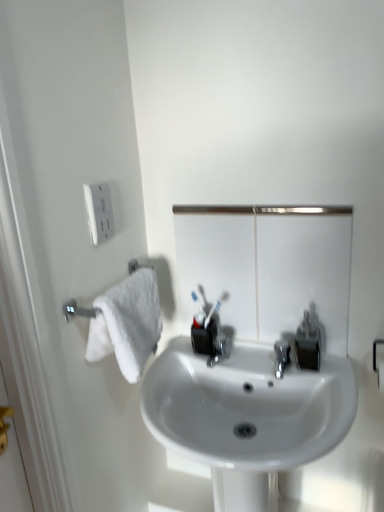
Question: Is matte black soap dispenser at center right bigger than metallic reflective mirror at center?

Choices:
 (A) yes
 (B) no

Answer: (B)

Question: Does matte black soap dispenser at center right have a lesser height compared to metallic reflective mirror at center?

Choices:
 (A) yes
 (B) no

Answer: (A)

Question: Is matte black soap dispenser at center right taller than metallic reflective mirror at center?

Choices:
 (A) no
 (B) yes

Answer: (A)

Question: Does matte black soap dispenser at center right come in front of metallic reflective mirror at center?

Choices:
 (A) no
 (B) yes

Answer: (A)

Question: Would you say matte black soap dispenser at center right contains metallic reflective mirror at center?

Choices:
 (A) yes
 (B) no

Answer: (B)

Question: Looking at their shapes, would you say white plastic outlet at upper left is wider or thinner than white glossy sink at center?

Choices:
 (A) wide
 (B) thin

Answer: (B)

Question: Is white plastic outlet at upper left taller or shorter than white glossy sink at center?

Choices:
 (A) tall
 (B) short

Answer: (B)

Question: Looking at the image, does white plastic outlet at upper left seem bigger or smaller compared to white glossy sink at center?

Choices:
 (A) small
 (B) big

Answer: (A)

Question: In the image, is white plastic outlet at upper left positioned in front of or behind white glossy sink at center?

Choices:
 (A) front
 (B) behind

Answer: (B)

Question: Is white glossy sink at center in front of or behind white plastic outlet at upper left in the image?

Choices:
 (A) front
 (B) behind

Answer: (A)

Question: From a real-world perspective, is white glossy sink at center above or below white plastic outlet at upper left?

Choices:
 (A) below
 (B) above

Answer: (A)

Question: Is white glossy sink at center inside the boundaries of white plastic outlet at upper left, or outside?

Choices:
 (A) inside
 (B) outside

Answer: (B)

Question: In terms of height, does white glossy sink at center look taller or shorter compared to white plastic outlet at upper left?

Choices:
 (A) tall
 (B) short

Answer: (A)

Question: Relative to matte black soap dispenser at center right, is white glossy sink at center in front or behind?

Choices:
 (A) behind
 (B) front

Answer: (B)

Question: Is point (158, 417) positioned closer to the camera than point (317, 350)?

Choices:
 (A) closer
 (B) farther

Answer: (A)